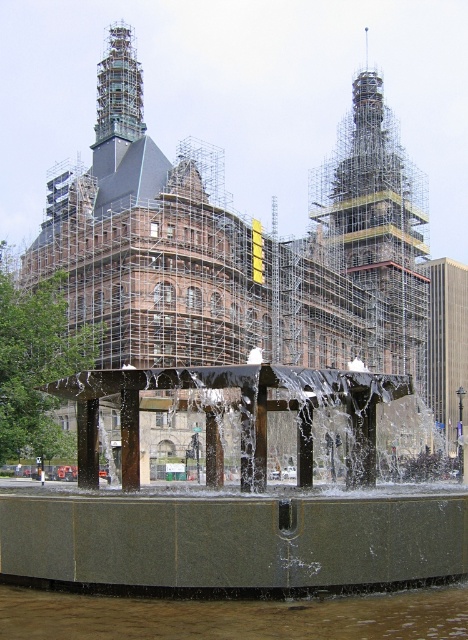
Question: Among these objects, which one is farthest from the camera?

Choices:
 (A) clear water at fountain bottom
 (B) green stone fountain at center

Answer: (B)

Question: In this image, where is green stone fountain at center located relative to clear water at fountain bottom?

Choices:
 (A) below
 (B) above

Answer: (B)

Question: Can you confirm if green stone fountain at center is wider than clear water at fountain bottom?

Choices:
 (A) no
 (B) yes

Answer: (B)

Question: Which of the following is the farthest from the observer?

Choices:
 (A) green stone fountain at center
 (B) clear water at fountain bottom

Answer: (A)

Question: In this image, where is green stone fountain at center located relative to clear water at fountain bottom?

Choices:
 (A) left
 (B) right

Answer: (A)